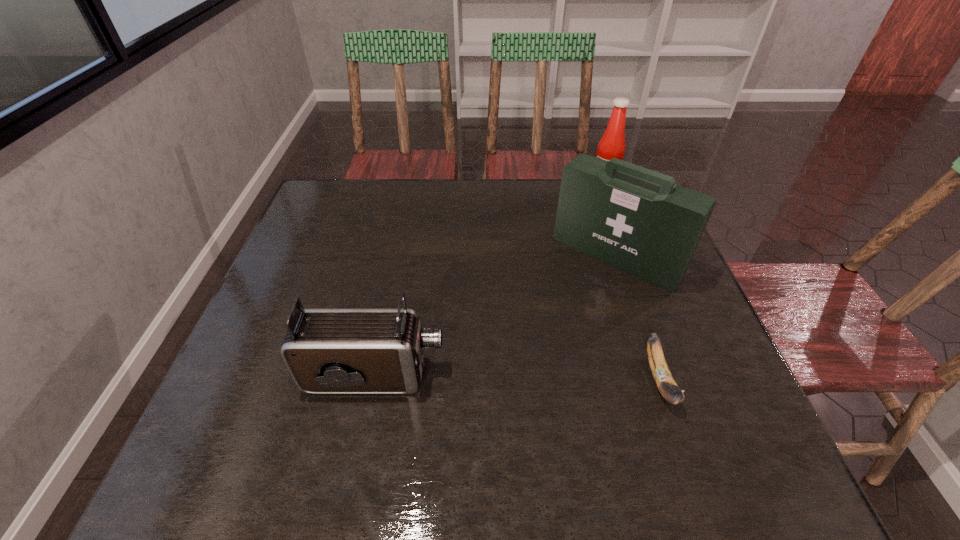
Image resolution: width=960 pixels, height=540 pixels. What are the coordinates of `object present at the far right corner` in the screenshot? It's located at (612, 144).

Image resolution: width=960 pixels, height=540 pixels. I want to click on object present at the near right corner, so pos(662,376).

The width and height of the screenshot is (960, 540). Identify the location of free location at the far edge of the desktop. (528, 197).

Find the location of a particular element. free space at the near edge is located at coordinates (350, 425).

Where is `vacant space at the left edge of the desktop`? Image resolution: width=960 pixels, height=540 pixels. vacant space at the left edge of the desktop is located at coordinates (339, 235).

The width and height of the screenshot is (960, 540). In the image, there is a desktop. Identify the location of vacant space at the right edge. (620, 276).

Identify the location of vacant area at the far left corner of the desktop. The width and height of the screenshot is (960, 540). (332, 183).

I want to click on vacant point at the near left corner, so [x=241, y=386].

Find the location of `vacant area between the second farthest object and the camcorder`. vacant area between the second farthest object and the camcorder is located at coordinates (495, 316).

What are the coordinates of `vacant region between the banana and the third nearest object` in the screenshot? It's located at (637, 318).